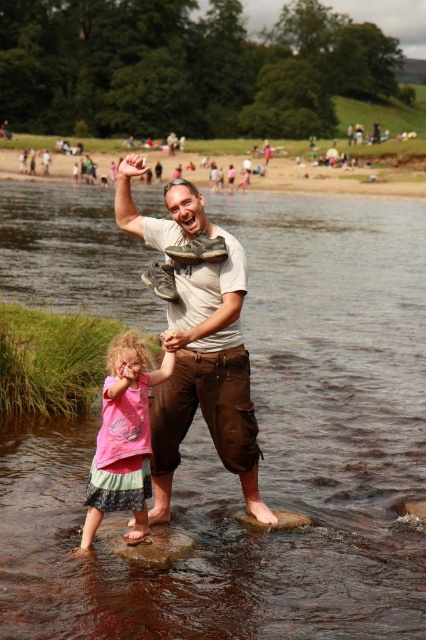
You are a photographer trying to capture the scene with a wide angle lens. The light brown cotton pants at center and brown smooth rock at lower center are in your frame. Which object will appear wider in the photo?

The light brown cotton pants at center will appear wider in the photo because its width is larger than the brown smooth rock at lower center.